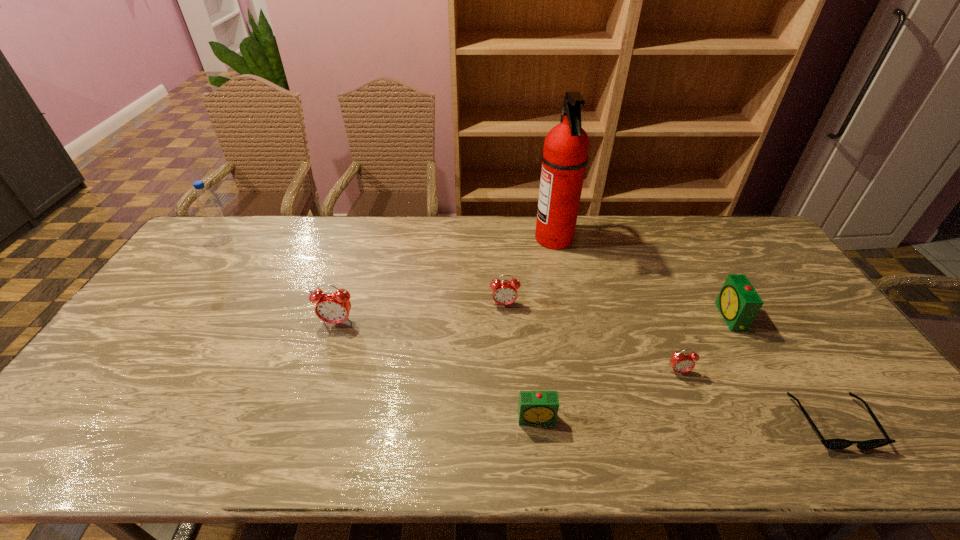
You are a GUI agent. You are given a task and a screenshot of the screen. Output one action in this format:
    pyautogui.click(x=<x>, y=<y>)
    Task: Click on the third nearest object
    This screenshot has width=960, height=540.
    Given the screenshot: What is the action you would take?
    pyautogui.click(x=681, y=362)

Locate an element on the screen. the second nearest alarm clock is located at coordinates (681, 362).

Identify the location of the nearer green alarm clock. This screenshot has height=540, width=960. (535, 407).

At what (x,y) coordinates should I click in order to perform the action: click on the nearest alarm clock. Please return your answer as a coordinate pair (x, y). Looking at the image, I should click on (535, 407).

Where is `the shortest object`? Image resolution: width=960 pixels, height=540 pixels. the shortest object is located at coordinates (835, 444).

You are a GUI agent. You are given a task and a screenshot of the screen. Output one action in this format:
    pyautogui.click(x=<x>, y=<y>)
    Task: Click on the black sunglasses
    This screenshot has width=960, height=540.
    Given the screenshot: What is the action you would take?
    pyautogui.click(x=835, y=444)

Where is `free space located on the side of the fourth object from right to left near the handle`? free space located on the side of the fourth object from right to left near the handle is located at coordinates (481, 239).

Image resolution: width=960 pixels, height=540 pixels. I want to click on free region located on the side of the fourth object from right to left near the handle, so click(x=422, y=239).

Identify the location of free space located on the side of the fourth object from right to left near the handle. Image resolution: width=960 pixels, height=540 pixels. (497, 239).

Identify the location of free point located 0.350m on the front of the seventh shortest object. (169, 319).